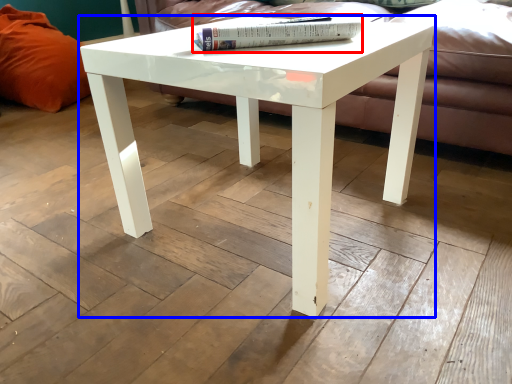
Question: Which object is closer to the camera taking this photo, book (highlighted by a red box) or coffee table (highlighted by a blue box)?

Choices:
 (A) book
 (B) coffee table

Answer: (B)